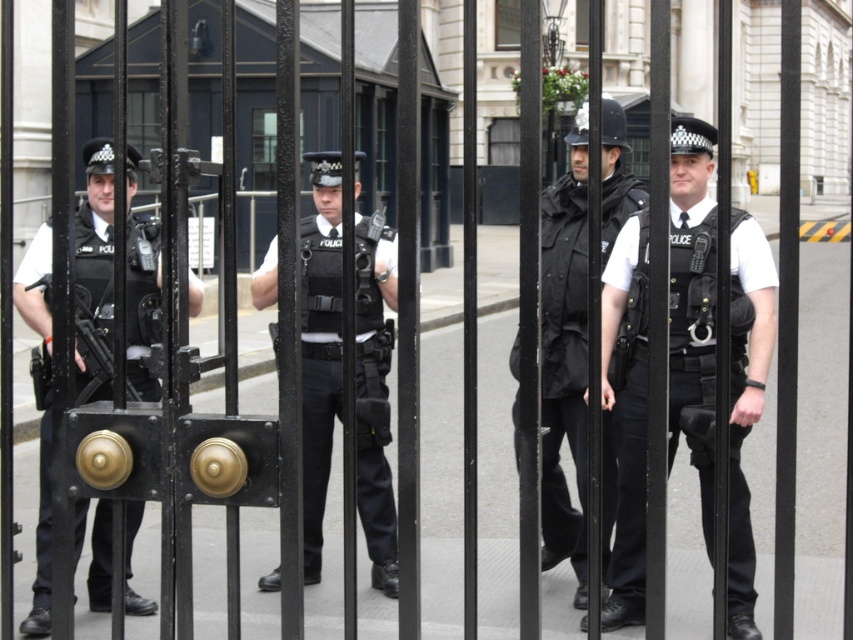
You are a tailor who needs to determine which uniform requires more fabric based on their size. Given that you see both the black matte uniform at center and the white matte uniform at center in the image, which one would need more fabric?

The black matte uniform at center requires more fabric because its width is larger than the white matte uniform at center.

You are a security guard observing two police officers in the scene. You notice their uniforms labeled as matte black uniform at left and black matte uniform at center. Which uniform is positioned more to the left?

The matte black uniform at left is positioned more to the left than the black matte uniform at center.